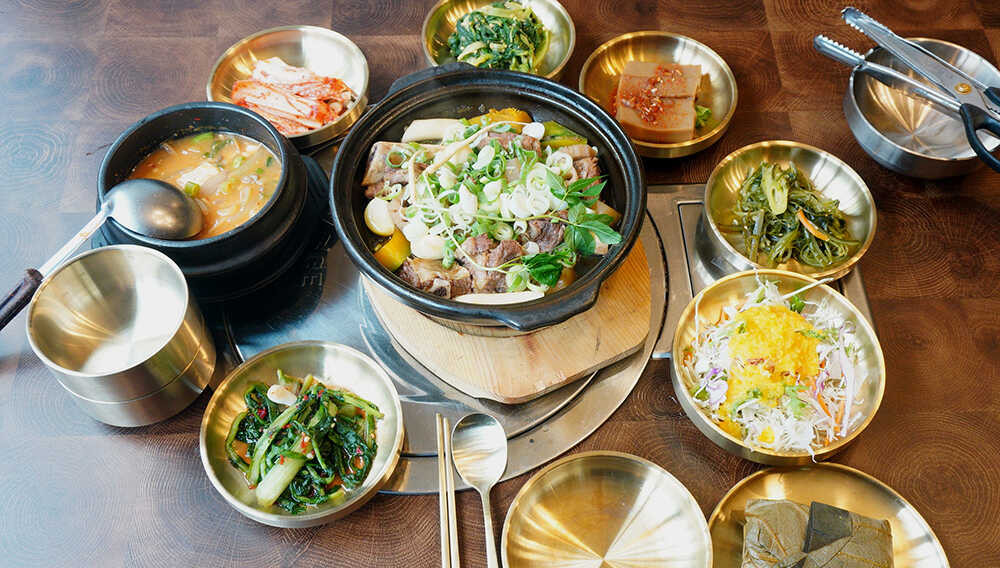
Image resolution: width=1000 pixels, height=568 pixels. Identify the location of stove. (676, 262).